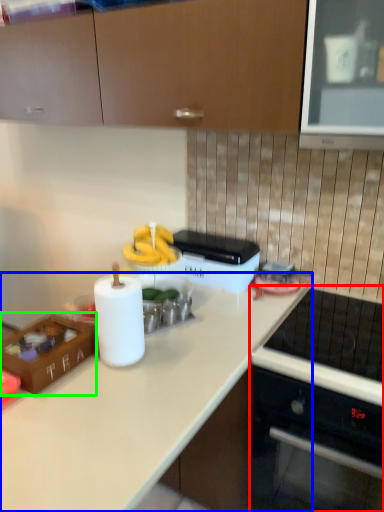
Question: Based on their relative distances, which object is nearer to home appliance (highlighted by a red box)? Choose from countertop (highlighted by a blue box) and kitchen appliance (highlighted by a green box).

Choices:
 (A) countertop
 (B) kitchen appliance

Answer: (A)